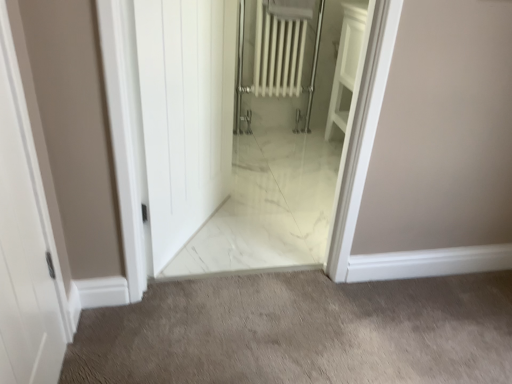
Question: Is white marble elevator at center located outside white marble floor at center?

Choices:
 (A) yes
 (B) no

Answer: (A)

Question: From a real-world perspective, is white marble elevator at center positioned over white marble floor at center based on gravity?

Choices:
 (A) yes
 (B) no

Answer: (A)

Question: Is white marble elevator at center smaller than white marble floor at center?

Choices:
 (A) yes
 (B) no

Answer: (B)

Question: Is white marble elevator at center far from white marble floor at center?

Choices:
 (A) no
 (B) yes

Answer: (A)

Question: Could you tell me if white marble elevator at center is facing white marble floor at center?

Choices:
 (A) no
 (B) yes

Answer: (A)

Question: Is white marble elevator at center further to camera compared to white marble floor at center?

Choices:
 (A) no
 (B) yes

Answer: (A)

Question: Can you confirm if white marble floor at center is taller than white matte door at left, which ranks as the 2th door in right-to-left order?

Choices:
 (A) yes
 (B) no

Answer: (B)

Question: Considering the relative sizes of white marble floor at center and white matte door at left, the 1th door from the left, in the image provided, is white marble floor at center smaller than white matte door at left, the 1th door from the left,?

Choices:
 (A) yes
 (B) no

Answer: (B)

Question: Can you confirm if white marble floor at center is positioned to the right of white matte door at left, marked as the 1th door in a front-to-back arrangement?

Choices:
 (A) no
 (B) yes

Answer: (B)

Question: Is white marble floor at center further to the viewer compared to white matte door at left, the second door in the back-to-front sequence?

Choices:
 (A) yes
 (B) no

Answer: (A)

Question: Is white matte door at left, which ranks as the 2th door in right-to-left order, surrounded by white marble floor at center?

Choices:
 (A) yes
 (B) no

Answer: (B)

Question: Can you confirm if white marble floor at center is positioned to the left of white matte door at left, the 1th door from the left?

Choices:
 (A) yes
 (B) no

Answer: (B)

Question: Can you see white glossy door at center, the 2th door when ordered from left to right, touching white marble elevator at center?

Choices:
 (A) yes
 (B) no

Answer: (B)